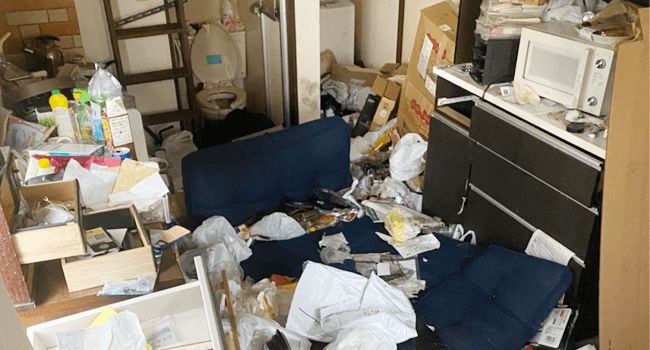
Where is `toilet`? The image size is (650, 350). toilet is located at coordinates (x=216, y=89).